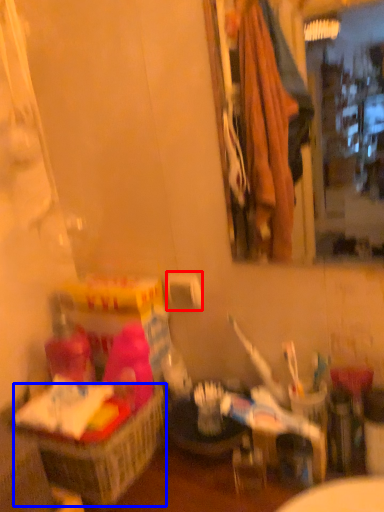
Question: Which point is further to the camera, toilet paper (highlighted by a red box) or basket (highlighted by a blue box)?

Choices:
 (A) toilet paper
 (B) basket

Answer: (A)